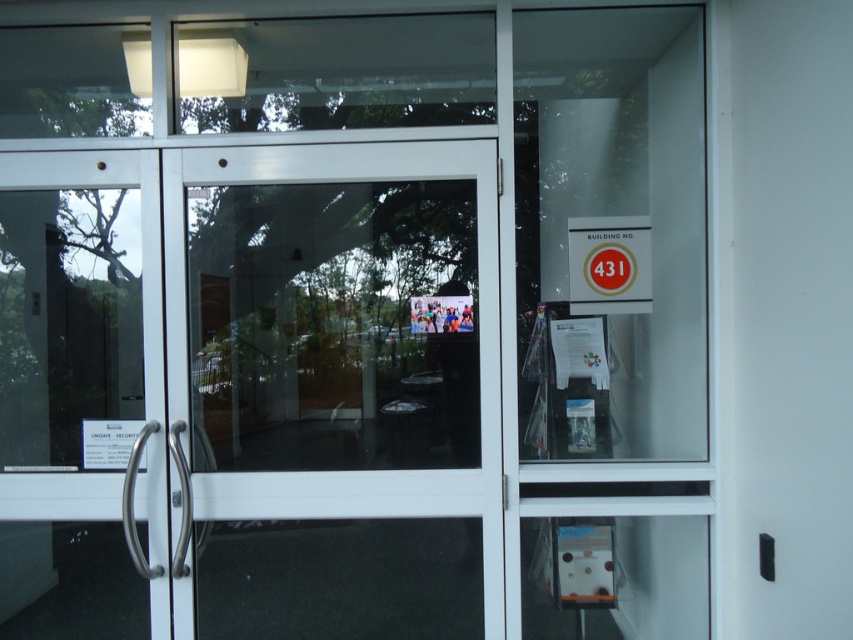
Question: Which point is farther to the camera?

Choices:
 (A) (608, 220)
 (B) (316, 397)

Answer: (B)

Question: Is transparent glass door at center smaller than matte gold sign at upper right?

Choices:
 (A) no
 (B) yes

Answer: (A)

Question: Is transparent glass door at center further to the viewer compared to matte gold sign at upper right?

Choices:
 (A) no
 (B) yes

Answer: (B)

Question: Which of the following is the farthest from the observer?

Choices:
 (A) (596, 301)
 (B) (474, 260)

Answer: (A)

Question: Does transparent glass door at center have a greater width compared to matte gold sign at upper right?

Choices:
 (A) no
 (B) yes

Answer: (B)